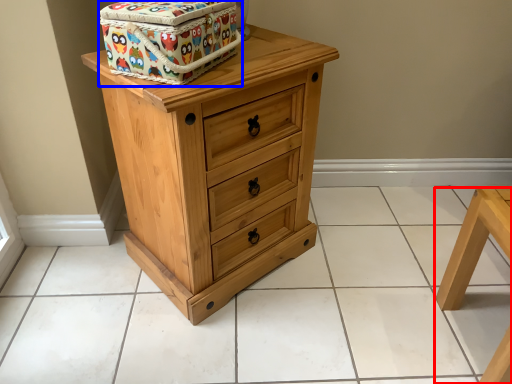
Question: Which object is further to the camera taking this photo, furniture (highlighted by a red box) or cardboard box (highlighted by a blue box)?

Choices:
 (A) furniture
 (B) cardboard box

Answer: (A)